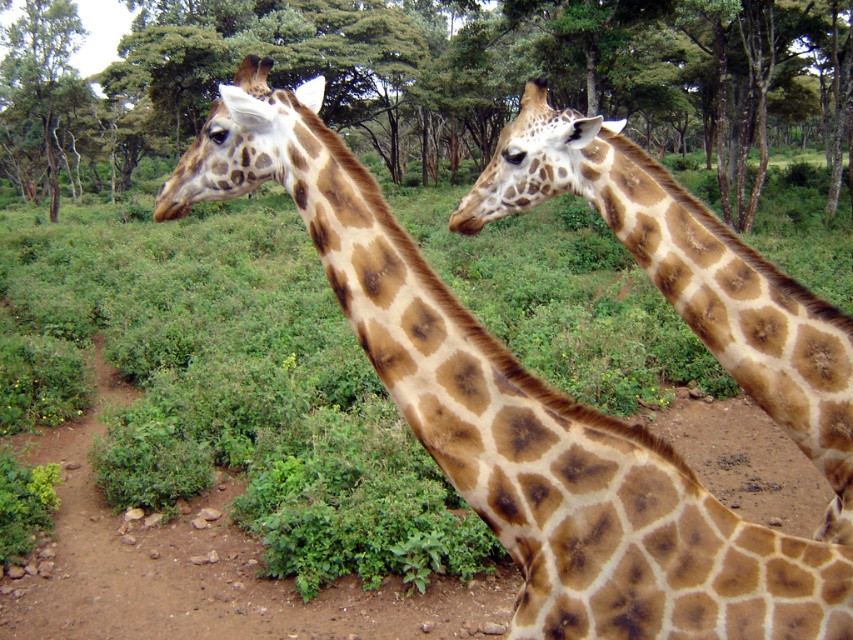
Who is more distant from viewer, (821, 472) or (27, 596)?

Positioned behind is point (27, 596).

Is point (558, 118) in front of point (1, 634)?

Yes, it is.

You are a GUI agent. You are given a task and a screenshot of the screen. Output one action in this format:
    pyautogui.click(x=<x>, y=<y>)
    Task: Click on the spotted brown giraffe at center
    This screenshot has width=853, height=640.
    Given the screenshot: What is the action you would take?
    pyautogui.click(x=689, y=275)

Which is more to the left, green leafy tree at center or spotted brown giraffe at center?

green leafy tree at center is more to the left.

Is green leafy tree at center to the right of spotted brown giraffe at center from the viewer's perspective?

No, green leafy tree at center is not to the right of spotted brown giraffe at center.

Is point (514, 99) less distant than point (734, 301)?

No, it is not.

Locate an element on the screen. green leafy tree at center is located at coordinates (440, 77).

Does green leafy tree at center have a greater width compared to brown dirt track at center?

Yes, green leafy tree at center is wider than brown dirt track at center.

Does point (659, 67) come in front of point (199, 490)?

No, (659, 67) is further to viewer.

This screenshot has height=640, width=853. I want to click on green leafy tree at center, so click(440, 77).